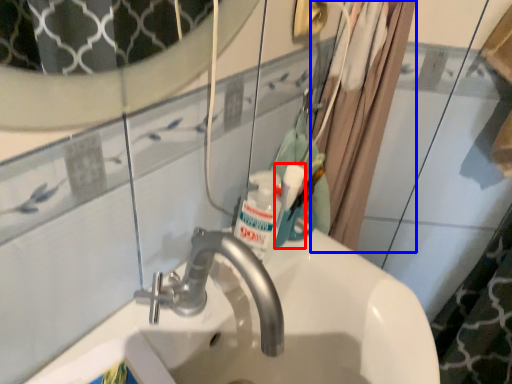
Question: Among these objects, which one is farthest to the camera, mouthwash (highlighted by a red box) or shower curtain (highlighted by a blue box)?

Choices:
 (A) mouthwash
 (B) shower curtain

Answer: (A)